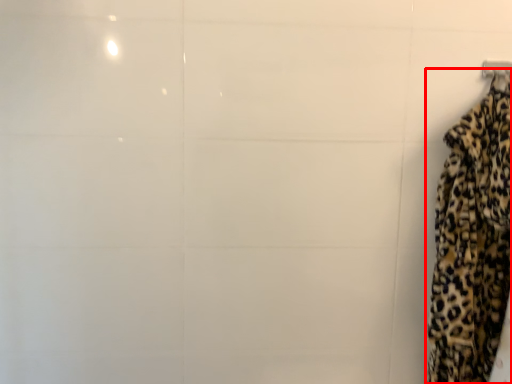
Question: Where is curtain (annotated by the red box) located in relation to hanger in the image?

Choices:
 (A) left
 (B) right

Answer: (A)